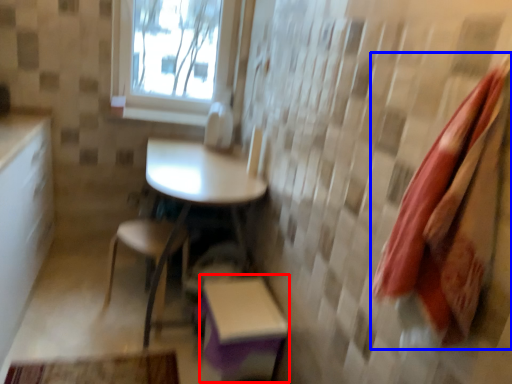
Question: Which of the following is the closest to the observer, step stool (highlighted by a red box) or beach towel (highlighted by a blue box)?

Choices:
 (A) step stool
 (B) beach towel

Answer: (B)